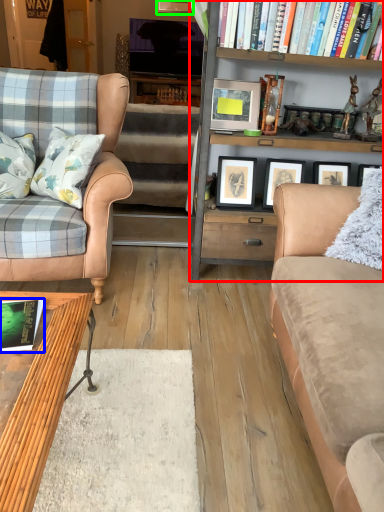
Question: Which is nearer to the bookcase (highlighted by a red box)? book (highlighted by a blue box) or picture frame (highlighted by a green box).

Choices:
 (A) book
 (B) picture frame

Answer: (A)